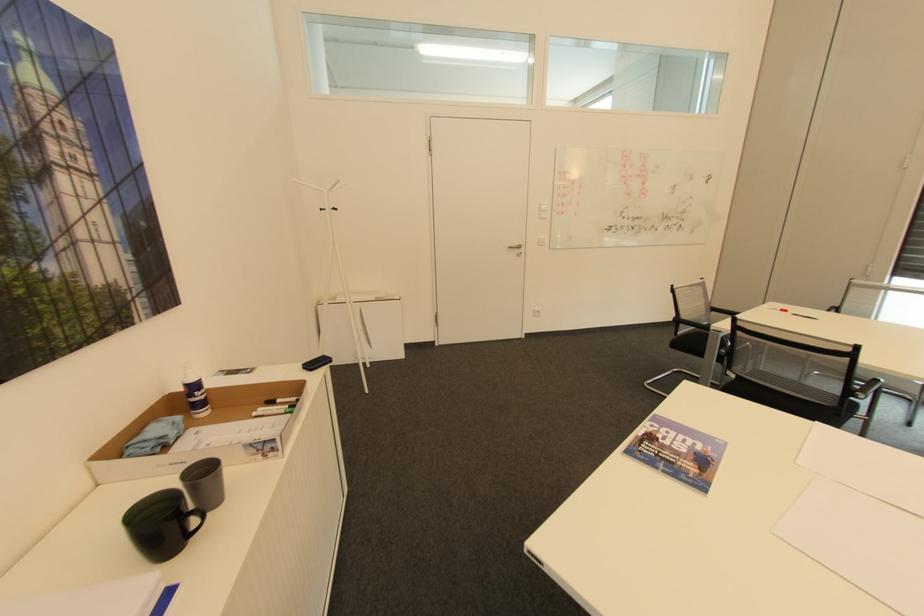
What do you see at coordinates (516, 248) in the screenshot? This screenshot has height=616, width=924. I see `a silver door handle` at bounding box center [516, 248].